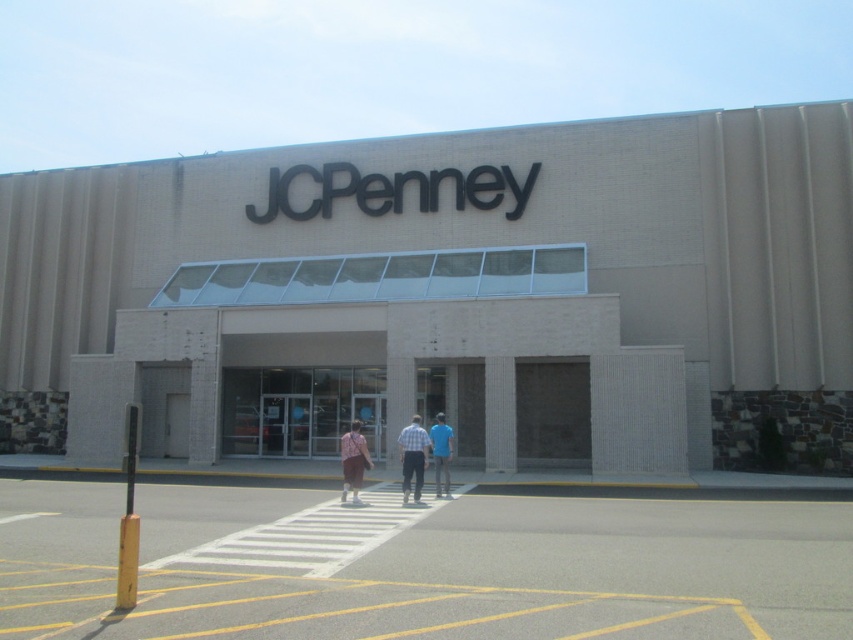
Question: Which is nearer to the white brick storefront at center?

Choices:
 (A) plaid cotton shirt at center
 (B) matte pink shirt at center
 (C) beige brick mall at center

Answer: (C)

Question: Can you confirm if blue plaid shirt at center is thinner than blue cotton shirt at center?

Choices:
 (A) no
 (B) yes

Answer: (A)

Question: Does beige brick mall at center have a lesser width compared to matte pink shirt at center?

Choices:
 (A) no
 (B) yes

Answer: (A)

Question: Which of the following is the farthest from the observer?

Choices:
 (A) blue plaid shirt at center
 (B) plaid cotton shirt at center

Answer: (A)

Question: Which object is positioned farthest from the blue cotton shirt at center?

Choices:
 (A) plaid cotton shirt at center
 (B) beige brick mall at center

Answer: (B)

Question: Does beige brick mall at center have a smaller size compared to white brick storefront at center?

Choices:
 (A) yes
 (B) no

Answer: (B)